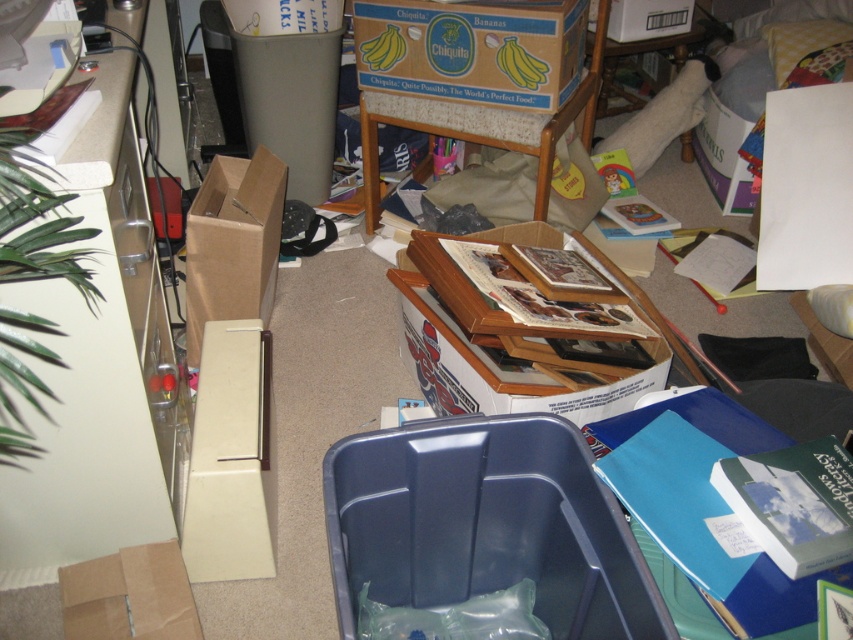
You are standing in the room and want to pick up two items located at the points marked as point (389, 449) and point (265, 204). Which item should you pick up first to minimize the distance you have to walk?

You should pick up the item at point (389, 449) first because it is closer to you than point (265, 204), so you can retrieve it without moving further away.

You are organizing the items in the room and need to stack the beige cardboard box at left and the brown paper bag at lower left on top of each other. Which one should you place at the bottom to ensure stability?

The beige cardboard box at left is taller than the brown paper bag at lower left, so placing the beige cardboard box at left at the bottom would provide a stable base for the stack.

You are organizing items in a room and need to place the brown paper bag at lower left and the white cardboard box at upper center. Which object is positioned higher up in the image?

The white cardboard box at upper center is positioned higher up in the image than the brown paper bag at lower left.